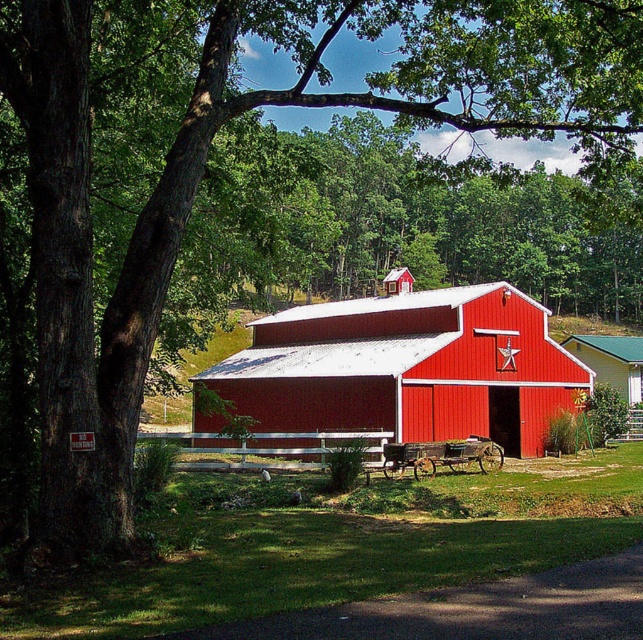
You are standing in a field and want to take a photo of the smooth red barn at center. If you are currently 33.76 meters away from it, is the barn in your camera view? Please consider the typical camera lens focal length of 50mm and a sensor size of 24mm x 36mm.

The smooth red barn at center is 33.76 meters away from the camera. With a typical camera lens focal length of 50mm and a sensor size of 24mm x 36mm, the barn would likely be within the camera view as the distance is within the standard field of view for such specifications.

You are standing at the center of the image and want to locate the smooth red barn at center. According to the coordinates provided, in which direction should you look to find it?

The smooth red barn at center is located at coordinates point (406, 368), so you should look slightly to the right and down from the very center of the image to find it.

In the scene shown: You are a painter standing in front of the smooth red barn at center and the red matte barn at center. You want to paint the part of the barn that is higher up. Which barn should you focus on painting?

The smooth red barn at center is above the red matte barn at center, so you should focus on painting the smooth red barn at center.